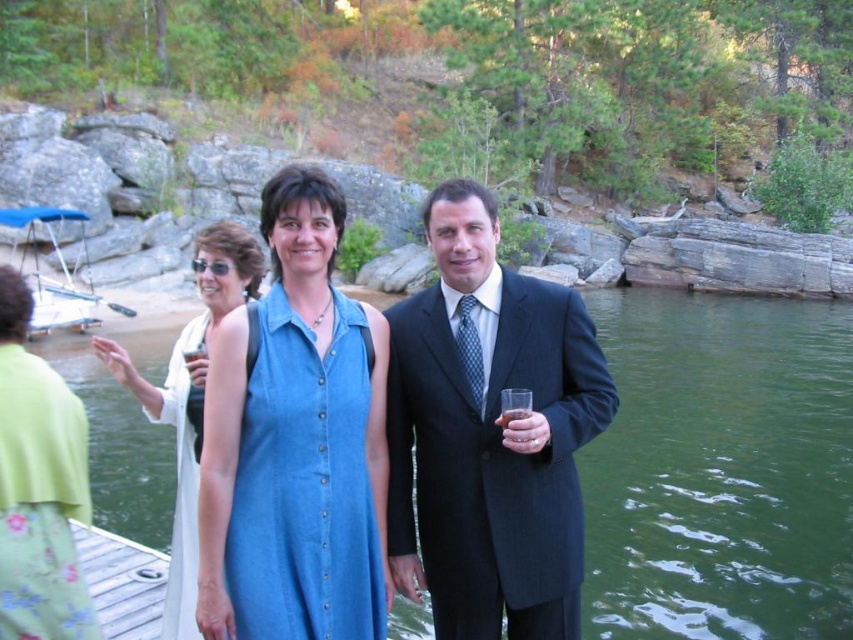
Does blue denim dress at center appear on the left side of translucent glass at right?

Indeed, blue denim dress at center is positioned on the left side of translucent glass at right.

This screenshot has width=853, height=640. Identify the location of blue denim dress at center. (489, 433).

Which is above, white satin dress at center or translucent glass at right?

translucent glass at right is higher up.

Who is more distant from viewer, (173,570) or (511,417)?

The point (173,570) is behind.

The height and width of the screenshot is (640, 853). Find the location of `white satin dress at center`. white satin dress at center is located at coordinates (183, 483).

Between denim dress at center and blue fabric boat at left, which one has more height?

With more height is blue fabric boat at left.

Is denim dress at center positioned behind blue fabric boat at left?

No, denim dress at center is closer to the viewer.

Image resolution: width=853 pixels, height=640 pixels. In order to click on denim dress at center in this screenshot , I will do `click(305, 483)`.